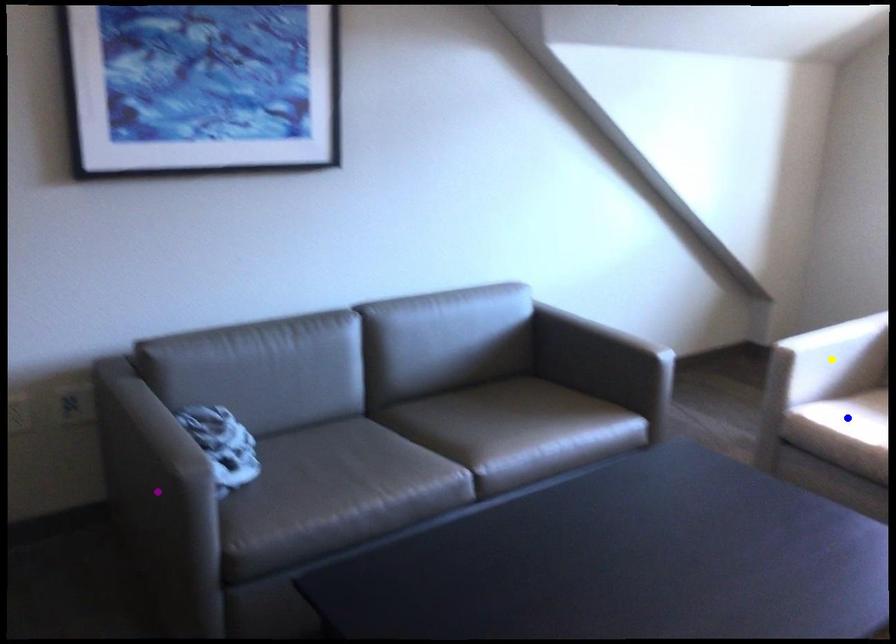
Order these from nearest to farthest:
yellow point, purple point, blue point

purple point
yellow point
blue point